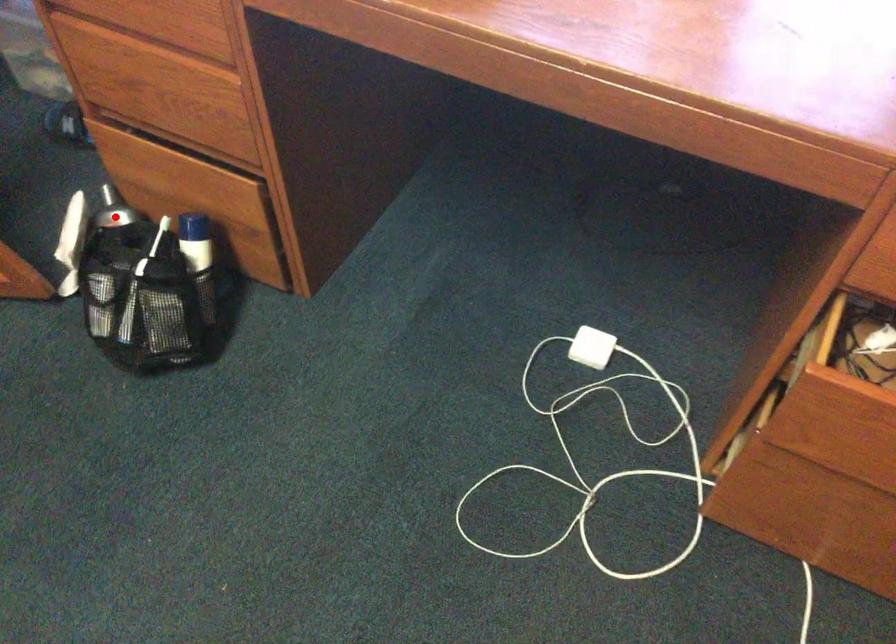
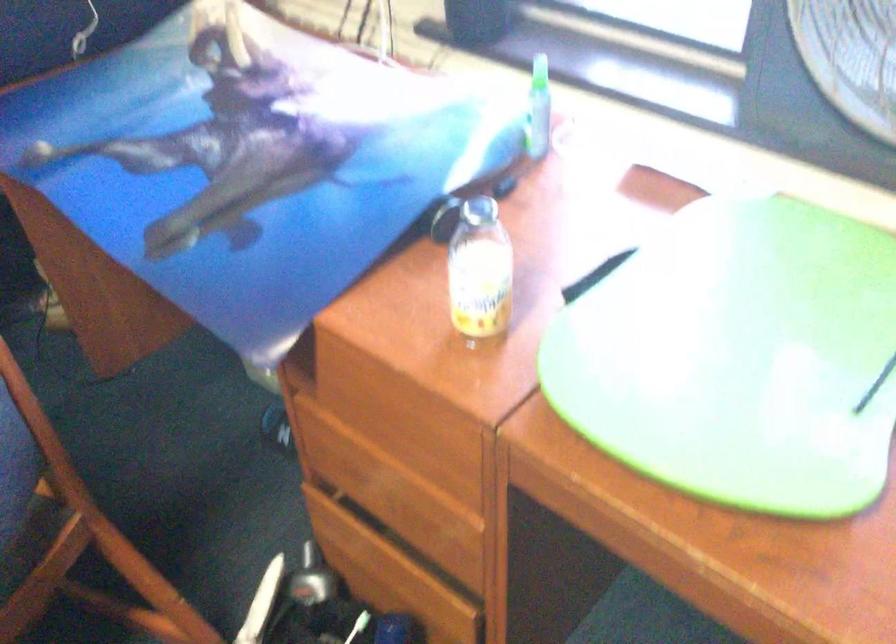
Locate, in the second image, the point that corresponds to the highlighted location in the first image.

(311, 579)